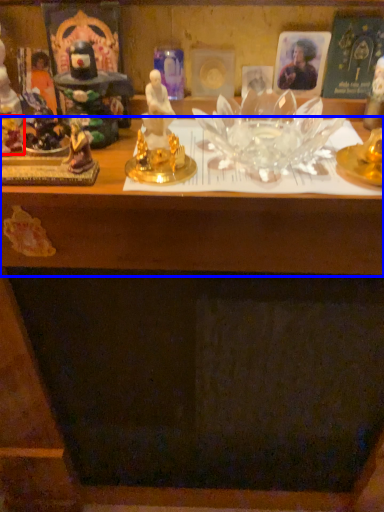
Question: Which point is closer to the camera, toy (highlighted by a red box) or table (highlighted by a blue box)?

Choices:
 (A) toy
 (B) table

Answer: (B)